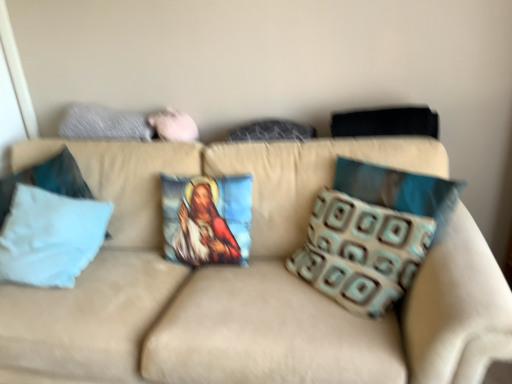
Locate an element on the screen. beige fabric couch at center is located at coordinates (253, 281).

How much space does brown textured pillow at right, marked as the 2th pillow in a right-to-left arrangement, occupy horizontally?

The width of brown textured pillow at right, marked as the 2th pillow in a right-to-left arrangement, is 11.72 inches.

The width and height of the screenshot is (512, 384). I want to click on textured gray pillow at upper left, the 3th pillow positioned from the left, so click(x=103, y=124).

Locate an element on the screen. The height and width of the screenshot is (384, 512). brown patterned pillow at right, marked as the 7th pillow in a left-to-right arrangement is located at coordinates (399, 190).

Does textured gray pillow at upper left, placed as the fifth pillow when sorted from right to left, have a greater width compared to printed fabric pillow with religious image at center, the 4th pillow from the left?

Incorrect, the width of textured gray pillow at upper left, placed as the fifth pillow when sorted from right to left, does not surpass that of printed fabric pillow with religious image at center, the 4th pillow from the left.

How far apart are textured gray pillow at upper left, the 3th pillow positioned from the left, and printed fabric pillow with religious image at center, the 4th pillow from the left?

21.36 inches.

Is textured gray pillow at upper left, the 3th pillow positioned from the left, positioned far away from printed fabric pillow with religious image at center, placed as the fourth pillow when sorted from right to left?

textured gray pillow at upper left, the 3th pillow positioned from the left, is actually quite close to printed fabric pillow with religious image at center, placed as the fourth pillow when sorted from right to left.

Is the position of textured gray pillow at upper left, the 3th pillow positioned from the left, more distant than that of printed fabric pillow with religious image at center, placed as the fourth pillow when sorted from right to left?

Yes.

From a real-world perspective, who is located higher, beige fabric couch at center or textured gray pillow at upper left, the 3th pillow positioned from the left?

textured gray pillow at upper left, the 3th pillow positioned from the left.

Is beige fabric couch at center placed right next to textured gray pillow at upper left, the 3th pillow positioned from the left?

No, beige fabric couch at center is not in contact with textured gray pillow at upper left, the 3th pillow positioned from the left.

Is beige fabric couch at center further to the viewer compared to textured gray pillow at upper left, the 3th pillow positioned from the left?

No, it is not.

What's the angular difference between beige fabric couch at center and textured gray pillow at upper left, placed as the fifth pillow when sorted from right to left,'s facing directions?

The facing directions of beige fabric couch at center and textured gray pillow at upper left, placed as the fifth pillow when sorted from right to left, are 0.864 degrees apart.

How distant is textured gray pillow at upper left, the 3th pillow positioned from the left, from brown patterned pillow at right, marked as the 7th pillow in a left-to-right arrangement?

textured gray pillow at upper left, the 3th pillow positioned from the left, is 3.80 feet away from brown patterned pillow at right, marked as the 7th pillow in a left-to-right arrangement.

Between textured gray pillow at upper left, the 3th pillow positioned from the left, and brown patterned pillow at right, the 1th pillow positioned from the right, which one appears on the right side from the viewer's perspective?

Positioned to the right is brown patterned pillow at right, the 1th pillow positioned from the right.

Can you see textured gray pillow at upper left, the 3th pillow positioned from the left, touching brown patterned pillow at right, marked as the 7th pillow in a left-to-right arrangement?

No.

Can you tell me how much textured gray pillow at upper left, placed as the fifth pillow when sorted from right to left, and brown patterned pillow at right, marked as the 7th pillow in a left-to-right arrangement, differ in facing direction?

The angular difference between textured gray pillow at upper left, placed as the fifth pillow when sorted from right to left, and brown patterned pillow at right, marked as the 7th pillow in a left-to-right arrangement, is 34 degrees.

Is textured gray pillow at upper left, placed as the fifth pillow when sorted from right to left, spatially inside white fabric pillow at left, the 6th pillow from the right, or outside of it?

textured gray pillow at upper left, placed as the fifth pillow when sorted from right to left, is spatially situated outside white fabric pillow at left, the 6th pillow from the right.

From the image's perspective, does textured gray pillow at upper left, the 3th pillow positioned from the left, appear lower than white fabric pillow at left, the 6th pillow from the right?

Actually, textured gray pillow at upper left, the 3th pillow positioned from the left, appears above white fabric pillow at left, the 6th pillow from the right, in the image.

From a real-world perspective, is textured gray pillow at upper left, the 3th pillow positioned from the left, positioned under white fabric pillow at left, the 2th pillow in the left-to-right sequence, based on gravity?

No, from a real-world perspective, textured gray pillow at upper left, the 3th pillow positioned from the left, is not under white fabric pillow at left, the 2th pillow in the left-to-right sequence.

Does textured gray pillow at upper left, the 3th pillow positioned from the left, appear on the right side of white fabric pillow at left, the 6th pillow from the right?

Yes.

Considering the sizes of objects textured fabric pillow at center, arranged as the fifth pillow when viewed from the left, and white fabric pillow at left, the 6th pillow from the right, in the image provided, who is thinner, textured fabric pillow at center, arranged as the fifth pillow when viewed from the left, or white fabric pillow at left, the 6th pillow from the right,?

Thinner between the two is textured fabric pillow at center, arranged as the fifth pillow when viewed from the left.

Is textured fabric pillow at center, arranged as the fifth pillow when viewed from the left, facing towards white fabric pillow at left, the 2th pillow in the left-to-right sequence?

No, textured fabric pillow at center, arranged as the fifth pillow when viewed from the left, is not facing towards white fabric pillow at left, the 2th pillow in the left-to-right sequence.

Which point is more forward, [252,137] or [55,213]?

The point [55,213] is closer.

Considering the sizes of objects textured fabric pillow at center, which is the third pillow in right-to-left order, and white fabric pillow at left, the 6th pillow from the right, in the image provided, who is shorter, textured fabric pillow at center, which is the third pillow in right-to-left order, or white fabric pillow at left, the 6th pillow from the right,?

With less height is textured fabric pillow at center, which is the third pillow in right-to-left order.

Considering the positions of objects printed fabric pillow with religious image at center, placed as the fourth pillow when sorted from right to left, and white fabric pillow at left, the 6th pillow from the right, in the image provided, who is in front, printed fabric pillow with religious image at center, placed as the fourth pillow when sorted from right to left, or white fabric pillow at left, the 6th pillow from the right,?

white fabric pillow at left, the 6th pillow from the right, is more forward.

How many degrees apart are the facing directions of printed fabric pillow with religious image at center, placed as the fourth pillow when sorted from right to left, and white fabric pillow at left, the 2th pillow in the left-to-right sequence?

0.000237 degrees.

Considering the positions of point (213, 190) and point (1, 242), is point (213, 190) closer or farther from the camera than point (1, 242)?

Point (213, 190) is closer to the camera than point (1, 242).

From the image's perspective, is printed fabric pillow with religious image at center, placed as the fourth pillow when sorted from right to left, positioned above or below white fabric pillow at left, the 2th pillow in the left-to-right sequence?

printed fabric pillow with religious image at center, placed as the fourth pillow when sorted from right to left, is above white fabric pillow at left, the 2th pillow in the left-to-right sequence.

From a real-world perspective, is textured fabric pillow at center, which is the third pillow in right-to-left order, located higher than textured gray pillow at upper left, placed as the fifth pillow when sorted from right to left?

No, from a real-world perspective, textured fabric pillow at center, which is the third pillow in right-to-left order, is not on top of textured gray pillow at upper left, placed as the fifth pillow when sorted from right to left.

Based on the photo, how different are the orientations of textured fabric pillow at center, which is the third pillow in right-to-left order, and textured gray pillow at upper left, placed as the fifth pillow when sorted from right to left, in degrees?

There is a 0.000131-degree angle between the facing directions of textured fabric pillow at center, which is the third pillow in right-to-left order, and textured gray pillow at upper left, placed as the fifth pillow when sorted from right to left.

Which is more to the left, textured fabric pillow at center, arranged as the fifth pillow when viewed from the left, or textured gray pillow at upper left, the 3th pillow positioned from the left?

textured gray pillow at upper left, the 3th pillow positioned from the left.

In the scene shown: How much distance is there between textured fabric pillow at center, arranged as the fifth pillow when viewed from the left, and textured gray pillow at upper left, placed as the fifth pillow when sorted from right to left?

24.96 inches.

Locate an element on the screen. This screenshot has height=384, width=512. the 3rd pillow in front of the textured gray pillow at upper left, placed as the fifth pillow when sorted from right to left, counting from the anchor's position is located at coordinates (207, 219).

Image resolution: width=512 pixels, height=384 pixels. In order to click on pillow that is the 7th object above the beige fabric couch at center (from a real-world perspective) in this screenshot , I will do `click(103, 124)`.

Considering their positions, is textured fabric pillow at center, arranged as the fifth pillow when viewed from the left, positioned further to printed fabric pillow with religious image at center, the 4th pillow from the left, than brown textured pillow at right, marked as the 2th pillow in a right-to-left arrangement?

Based on the image, brown textured pillow at right, marked as the 2th pillow in a right-to-left arrangement, appears to be further to printed fabric pillow with religious image at center, the 4th pillow from the left.

Based on their spatial positions, is white fabric pillow at left, arranged as the 1th pillow when viewed from the left, or brown patterned pillow at right, marked as the 7th pillow in a left-to-right arrangement, closer to white fabric pillow at left, the 6th pillow from the right?

white fabric pillow at left, arranged as the 1th pillow when viewed from the left, is closer to white fabric pillow at left, the 6th pillow from the right.

Based on their spatial positions, is white fabric pillow at left, arranged as the seventh pillow when viewed from the right, or textured gray pillow at upper left, placed as the fifth pillow when sorted from right to left, further from brown textured pillow at right, marked as the 2th pillow in a right-to-left arrangement?

white fabric pillow at left, arranged as the seventh pillow when viewed from the right, is positioned further to the anchor brown textured pillow at right, marked as the 2th pillow in a right-to-left arrangement.

From the image, which object appears to be nearer to printed fabric pillow with religious image at center, the 4th pillow from the left, brown patterned pillow at right, marked as the 7th pillow in a left-to-right arrangement, or beige fabric couch at center?

beige fabric couch at center is closer to printed fabric pillow with religious image at center, the 4th pillow from the left.

Considering their positions, is brown patterned pillow at right, the 1th pillow positioned from the right, positioned closer to textured gray pillow at upper left, placed as the fifth pillow when sorted from right to left, than white fabric pillow at left, arranged as the seventh pillow when viewed from the right?

Result: Among the two, white fabric pillow at left, arranged as the seventh pillow when viewed from the right, is located nearer to textured gray pillow at upper left, placed as the fifth pillow when sorted from right to left.

Looking at this image, based on their spatial positions, is textured fabric pillow at center, which is the third pillow in right-to-left order, or textured gray pillow at upper left, placed as the fifth pillow when sorted from right to left, further from white fabric pillow at left, arranged as the seventh pillow when viewed from the right?

textured fabric pillow at center, which is the third pillow in right-to-left order, is positioned further to the anchor white fabric pillow at left, arranged as the seventh pillow when viewed from the right.

When comparing their distances from printed fabric pillow with religious image at center, placed as the fourth pillow when sorted from right to left, does textured fabric pillow at center, arranged as the fifth pillow when viewed from the left, or beige fabric couch at center seem closer?

beige fabric couch at center is closer to printed fabric pillow with religious image at center, placed as the fourth pillow when sorted from right to left.

Based on their spatial positions, is textured fabric pillow at center, arranged as the fifth pillow when viewed from the left, or beige fabric couch at center closer to white fabric pillow at left, the 6th pillow from the right?

beige fabric couch at center is positioned closer to the anchor white fabric pillow at left, the 6th pillow from the right.

This screenshot has height=384, width=512. Find the location of `studio couch between white fabric pillow at left, arranged as the 1th pillow when viewed from the left, and brown patterned pillow at right, the 1th pillow positioned from the right, in the horizontal direction`. studio couch between white fabric pillow at left, arranged as the 1th pillow when viewed from the left, and brown patterned pillow at right, the 1th pillow positioned from the right, in the horizontal direction is located at coordinates (253, 281).

Find the location of a particular element. studio couch between white fabric pillow at left, the 6th pillow from the right, and textured fabric pillow at center, arranged as the fifth pillow when viewed from the left, from left to right is located at coordinates (253, 281).

The image size is (512, 384). In order to click on studio couch between textured gray pillow at upper left, placed as the fifth pillow when sorted from right to left, and brown patterned pillow at right, marked as the 7th pillow in a left-to-right arrangement in this screenshot , I will do 253,281.

The height and width of the screenshot is (384, 512). Find the location of `studio couch between white fabric pillow at left, arranged as the seventh pillow when viewed from the right, and brown textured pillow at right, the 6th pillow positioned from the left`. studio couch between white fabric pillow at left, arranged as the seventh pillow when viewed from the right, and brown textured pillow at right, the 6th pillow positioned from the left is located at coordinates (253, 281).